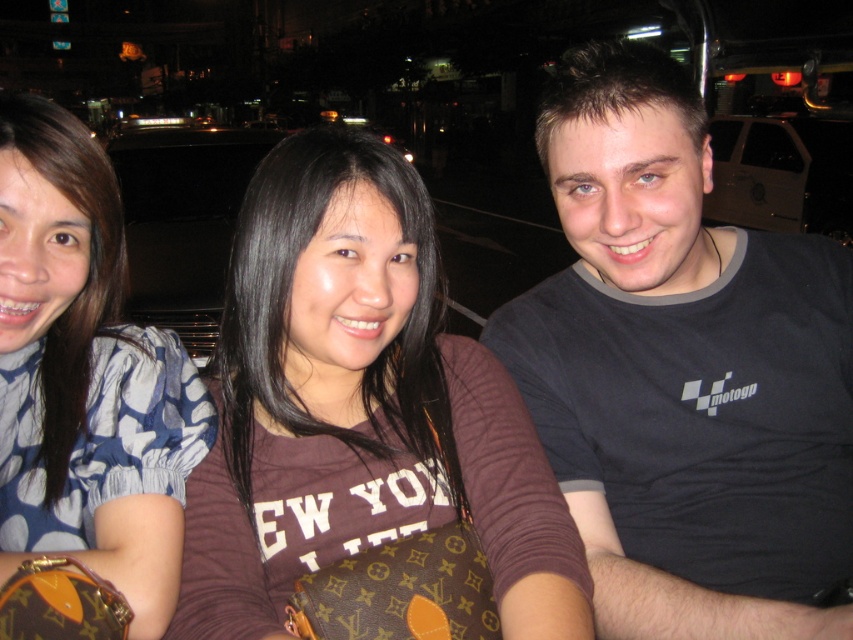
Question: Which point appears farthest from the camera in this image?

Choices:
 (A) (432, 348)
 (B) (32, 492)

Answer: (A)

Question: Among these objects, which one is nearest to the camera?

Choices:
 (A) blue dotted blouse at left
 (B) dark gray t-shirt at center

Answer: (A)

Question: Can you confirm if dark gray t-shirt at center is positioned to the left of blue dotted blouse at left?

Choices:
 (A) no
 (B) yes

Answer: (A)

Question: In this image, where is dark gray t-shirt at center located relative to brown fabric shirt at center?

Choices:
 (A) left
 (B) right

Answer: (B)

Question: Can you confirm if brown fabric shirt at center is thinner than blue dotted blouse at left?

Choices:
 (A) yes
 (B) no

Answer: (B)

Question: Based on their relative distances, which object is nearer to the dark gray t-shirt at center?

Choices:
 (A) brown fabric shirt at center
 (B) blue dotted blouse at left

Answer: (A)